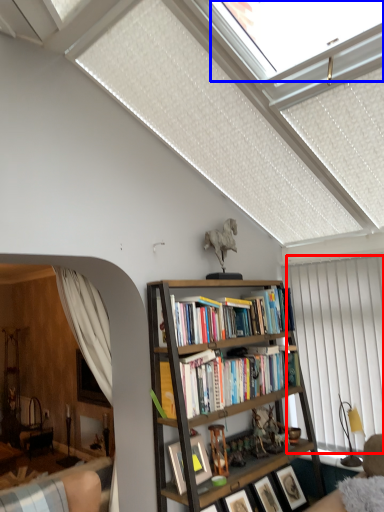
Question: Which object appears closest to the camera in this image, curtain (highlighted by a red box) or window (highlighted by a blue box)?

Choices:
 (A) curtain
 (B) window

Answer: (B)